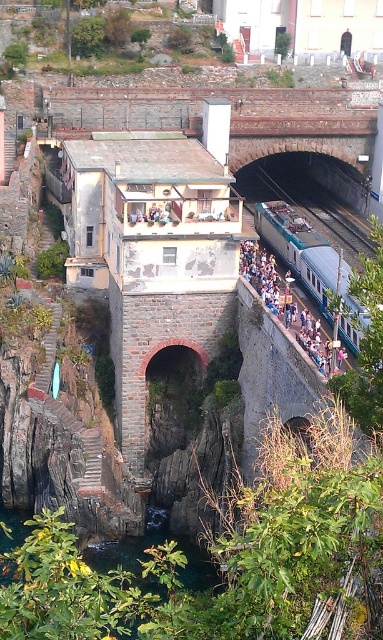
Is teal glossy train at center wider than smooth concrete train track at center?

In fact, teal glossy train at center might be narrower than smooth concrete train track at center.

Is teal glossy train at center above smooth concrete train track at center?

Incorrect, teal glossy train at center is not positioned above smooth concrete train track at center.

Which is in front, point (278, 216) or point (292, 182)?

Point (278, 216)

At what (x,y) coordinates should I click in order to perform the action: click on teal glossy train at center. Please return your answer as a coordinate pair (x, y). The width and height of the screenshot is (383, 640). Looking at the image, I should click on (299, 250).

Does teal glossy train at center have a larger size compared to blue fabric crowd at center?

Correct, teal glossy train at center is larger in size than blue fabric crowd at center.

Who is taller, teal glossy train at center or blue fabric crowd at center?

With more height is teal glossy train at center.

Is point (307, 282) positioned in front of point (271, 300)?

No, it is behind (271, 300).

Locate an element on the screen. This screenshot has width=383, height=640. teal glossy train at center is located at coordinates tap(299, 250).

Is smooth concrete train track at center wider than blue fabric crowd at center?

Yes, smooth concrete train track at center is wider than blue fabric crowd at center.

Is smooth concrete train track at center closer to camera compared to blue fabric crowd at center?

No.

Does point (279, 156) come behind point (319, 349)?

Yes, point (279, 156) is farther from viewer.

At what (x,y) coordinates should I click in order to perform the action: click on smooth concrete train track at center. Please return your answer as a coordinate pair (x, y). Looking at the image, I should click on (312, 200).